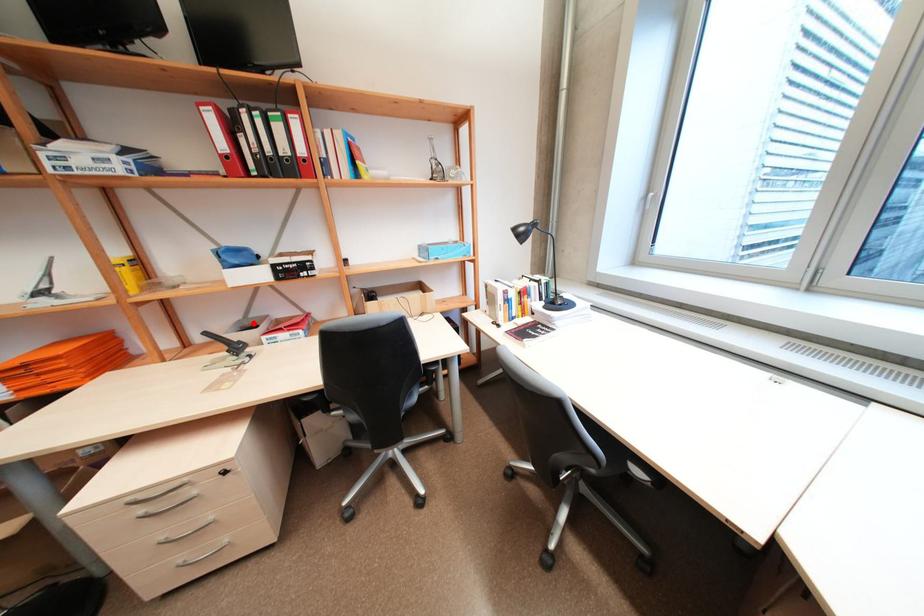
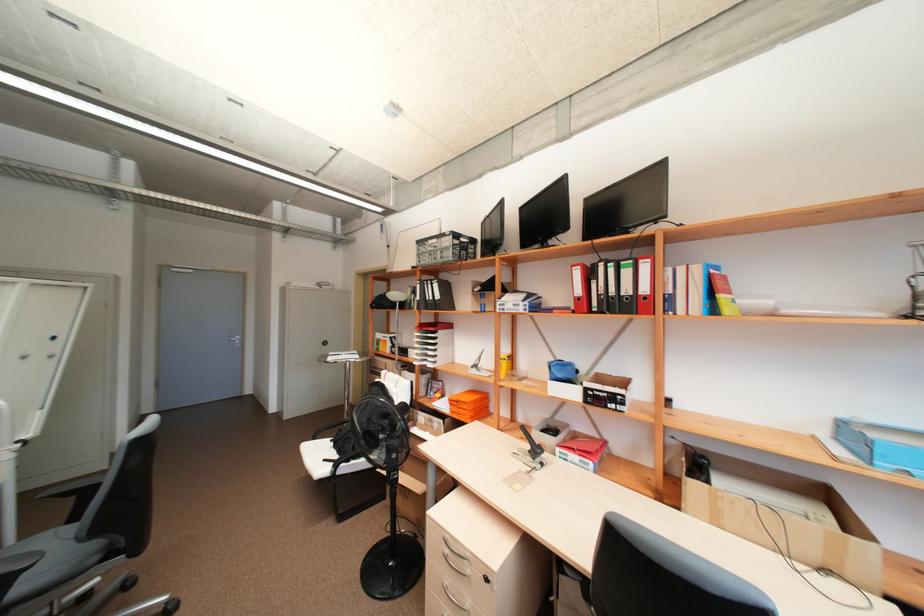
Question: I am providing you with two images of the same scene from different viewpoints. Image1 has a red point marked. In image2, the corresponding 3D location appears at what relative position? Reply with the corresponding letter.

Choices:
 (A) Closer
 (B) Farther

Answer: (B)